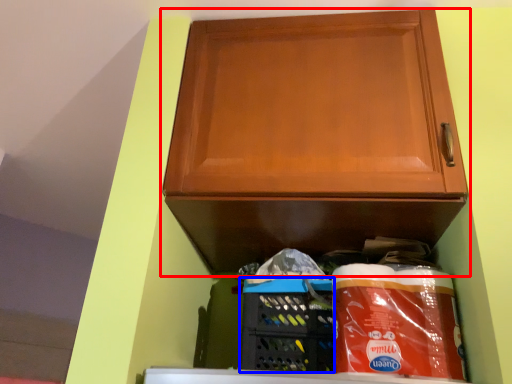
Question: Among these objects, which one is nearest to the camera, cabinetry (highlighted by a red box) or basket (highlighted by a blue box)?

Choices:
 (A) cabinetry
 (B) basket

Answer: (A)